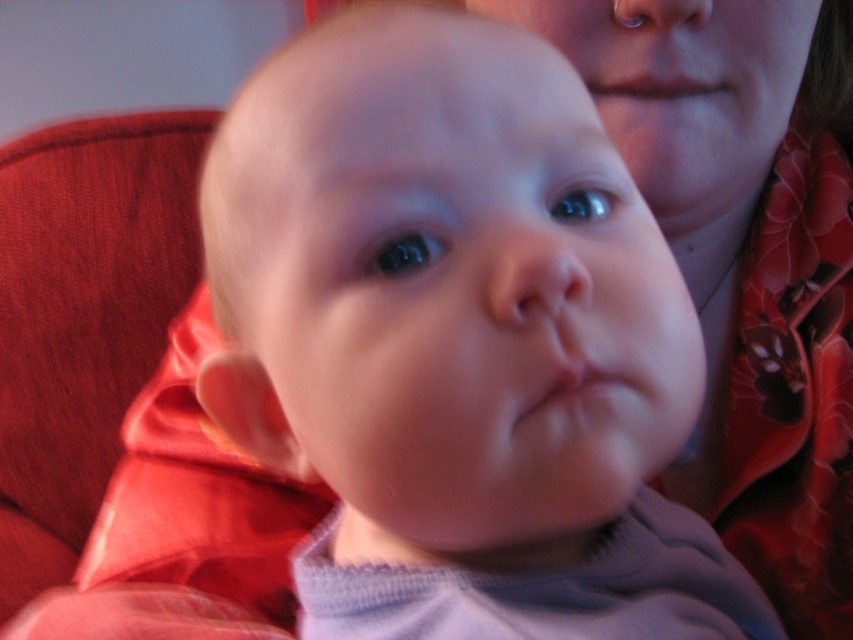
Question: Considering the real-world distances, which object is farthest from the smooth flesh nose at center?

Choices:
 (A) smooth skin nose at upper center
 (B) smooth skin baby at center

Answer: (A)

Question: Based on their relative distances, which object is farther from the smooth flesh nose at center?

Choices:
 (A) pink smooth lips at center
 (B) pink matte lips at upper center
 (C) smooth skin baby at center

Answer: (B)

Question: Where is smooth skin face at upper center located in relation to smooth flesh nose at center in the image?

Choices:
 (A) left
 (B) right

Answer: (B)

Question: Among these points, which one is farthest from the camera?

Choices:
 (A) (412, 113)
 (B) (664, 22)
 (C) (685, 92)
 (D) (518, 424)

Answer: (C)

Question: Is smooth flesh nose at center below pink matte lips at upper center?

Choices:
 (A) no
 (B) yes

Answer: (B)

Question: Where is smooth skin face at upper center located in relation to pink matte lips at upper center in the image?

Choices:
 (A) below
 (B) above

Answer: (A)